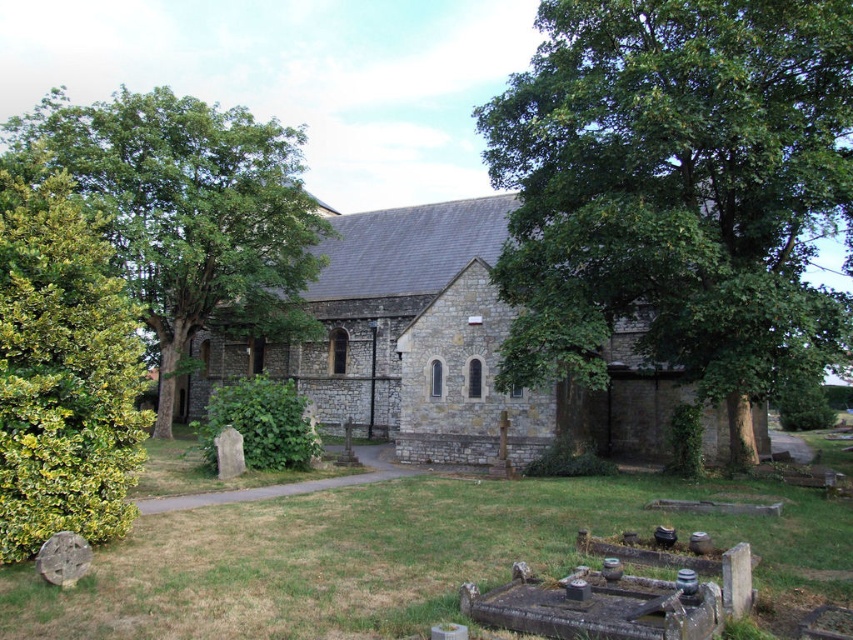
You are a visitor approaching the gray stone church at center and notice the green leafy tree at left nearby. Which object appears larger in the scene?

The green leafy tree at left appears larger than the gray stone church at center.

You are standing on the paved area in front of the church and want to take a photo of the church without any plants blocking the view. Which of the two plants, the green leafy tree at center or the green leafy bush at left, should you move to ensure a clear view?

The green leafy tree at center is taller than the green leafy bush at left. To ensure a clear view of the church, you should move the green leafy tree at center first since it is taller and more likely to block the view.

You are planning to install a small garden bench in the area between the green leafy tree at center and the green leafy bush at left. Considering their sizes, which object would require more space to maintain proper clearance?

The green leafy bush at left requires more space because it has a greater width than the green leafy tree at center.